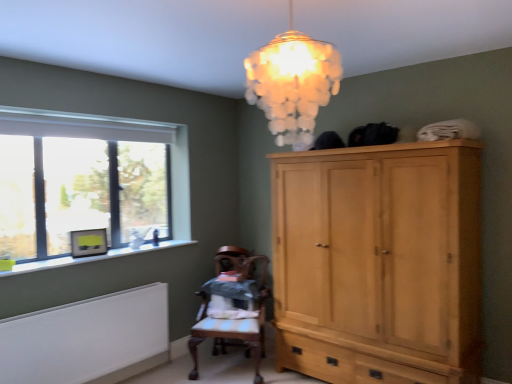
The height and width of the screenshot is (384, 512). Identify the location of light wood cabinet at right. (379, 262).

The height and width of the screenshot is (384, 512). What do you see at coordinates (88, 339) in the screenshot? I see `white painted radiator at lower left` at bounding box center [88, 339].

Locate an element on the screen. The width and height of the screenshot is (512, 384). clear glass window at left is located at coordinates (89, 184).

The image size is (512, 384). What are the coordinates of `light wood cabinet at right` in the screenshot? It's located at (379, 262).

Based on the photo, relative to clear glass window at left, is light wood cabinet at right in front or behind?

Clearly, light wood cabinet at right is in front of clear glass window at left.

Is light wood cabinet at right far away from clear glass window at left?

light wood cabinet at right is positioned a significant distance from clear glass window at left.

Which object is thinner, light wood cabinet at right or clear glass window at left?

clear glass window at left is thinner.

Is point (373, 310) positioned behind point (141, 193)?

That is False.

Is clear glass window at left placed right next to white painted radiator at lower left?

There is a gap between clear glass window at left and white painted radiator at lower left.

From the image's perspective, is clear glass window at left beneath white painted radiator at lower left?

No, from the image's perspective, clear glass window at left is not below white painted radiator at lower left.

Considering the positions of objects clear glass window at left and white painted radiator at lower left in the image provided, who is in front, clear glass window at left or white painted radiator at lower left?

white painted radiator at lower left is in front.

Between clear glass window at left and white painted radiator at lower left, which one appears on the right side from the viewer's perspective?

white painted radiator at lower left.

From a real-world perspective, relative to light wood cabinet at right, is translucent glass chandelier at upper center vertically above or below?

From a real-world perspective, translucent glass chandelier at upper center is physically above light wood cabinet at right.

Is translucent glass chandelier at upper center bigger than light wood cabinet at right?

No.

Who is taller, translucent glass chandelier at upper center or light wood cabinet at right?

light wood cabinet at right.

Between clear glass window at left and wooden chair at center, which one is positioned in front?

clear glass window at left is more forward.

Can wooden chair at center be found inside clear glass window at left?

Actually, wooden chair at center is outside clear glass window at left.

Can you see clear glass window at left touching wooden chair at center?

clear glass window at left and wooden chair at center are clearly separated.

Between point (31, 244) and point (238, 320), which one is positioned in front?

The point (31, 244) is closer.

From the image's perspective, between wooden chair at center and clear glass window at left, who is located below?

wooden chair at center is shown below in the image.

Locate an element on the screen. This screenshot has width=512, height=384. chair below the clear glass window at left (from the image's perspective) is located at coordinates (234, 299).

Can you tell me how much wooden chair at center and clear glass window at left differ in facing direction?

The angular difference between wooden chair at center and clear glass window at left is 60.3 degrees.

Is the position of wooden chair at center more distant than that of clear glass window at left?

Yes, wooden chair at center is behind clear glass window at left.

How many degrees apart are the facing directions of white painted radiator at lower left and light wood cabinet at right?

The facing directions of white painted radiator at lower left and light wood cabinet at right are 89.6 degrees apart.

Locate an element on the screen. The height and width of the screenshot is (384, 512). radiator on the left of the light wood cabinet at right is located at coordinates (88, 339).

Is white painted radiator at lower left facing away from light wood cabinet at right?

That's not correct — white painted radiator at lower left is not looking away from light wood cabinet at right.

Is white painted radiator at lower left outside of light wood cabinet at right?

→ Yes, white painted radiator at lower left is not within light wood cabinet at right.

Is wooden chair at center to the right of translucent glass chandelier at upper center from the viewer's perspective?

No.

From a real-world perspective, is wooden chair at center positioned above or below translucent glass chandelier at upper center?

From a real-world perspective, wooden chair at center is physically below translucent glass chandelier at upper center.

Is wooden chair at center far from translucent glass chandelier at upper center?

Yes, wooden chair at center and translucent glass chandelier at upper center are located far from each other.

From the image's perspective, relative to translucent glass chandelier at upper center, is wooden chair at center above or below?

wooden chair at center is situated lower than translucent glass chandelier at upper center in the image.

Image resolution: width=512 pixels, height=384 pixels. What are the coordinates of `cabinetry below the clear glass window at left (from the image's perspective)` in the screenshot? It's located at click(x=379, y=262).

Locate an element on the screen. Image resolution: width=512 pixels, height=384 pixels. radiator that is on the right side of clear glass window at left is located at coordinates (88, 339).

When comparing their distances from translucent glass chandelier at upper center, does clear glass window at left or white painted radiator at lower left seem closer?

clear glass window at left.

Looking at this image, based on their spatial positions, is translucent glass chandelier at upper center or white painted radiator at lower left closer to clear glass window at left?

Based on the image, white painted radiator at lower left appears to be nearer to clear glass window at left.

Looking at the image, which one is located closer to clear glass window at left, wooden chair at center or white painted radiator at lower left?

white painted radiator at lower left.

Which object lies nearer to the anchor point white painted radiator at lower left, wooden chair at center or light wood cabinet at right?

Among the two, wooden chair at center is located nearer to white painted radiator at lower left.

Looking at the image, which one is located further to clear glass window at left, white painted radiator at lower left or wooden chair at center?

wooden chair at center.

From the image, which object appears to be nearer to white painted radiator at lower left, clear glass window at left or translucent glass chandelier at upper center?

clear glass window at left lies closer to white painted radiator at lower left than the other object.

Estimate the real-world distances between objects in this image. Which object is further from translucent glass chandelier at upper center, white painted radiator at lower left or wooden chair at center?

The object further to translucent glass chandelier at upper center is white painted radiator at lower left.

Based on their spatial positions, is light wood cabinet at right or wooden chair at center further from white painted radiator at lower left?

light wood cabinet at right is further to white painted radiator at lower left.

The width and height of the screenshot is (512, 384). Find the location of `cabinetry positioned between translucent glass chandelier at upper center and wooden chair at center from near to far`. cabinetry positioned between translucent glass chandelier at upper center and wooden chair at center from near to far is located at coordinates (379, 262).

Where is `chair situated between white painted radiator at lower left and light wood cabinet at right from left to right`? The image size is (512, 384). chair situated between white painted radiator at lower left and light wood cabinet at right from left to right is located at coordinates (234, 299).

This screenshot has height=384, width=512. In order to click on lamp located between white painted radiator at lower left and light wood cabinet at right in the left-right direction in this screenshot , I will do `click(292, 83)`.

Locate an element on the screen. This screenshot has height=384, width=512. chair between clear glass window at left and light wood cabinet at right is located at coordinates (234, 299).